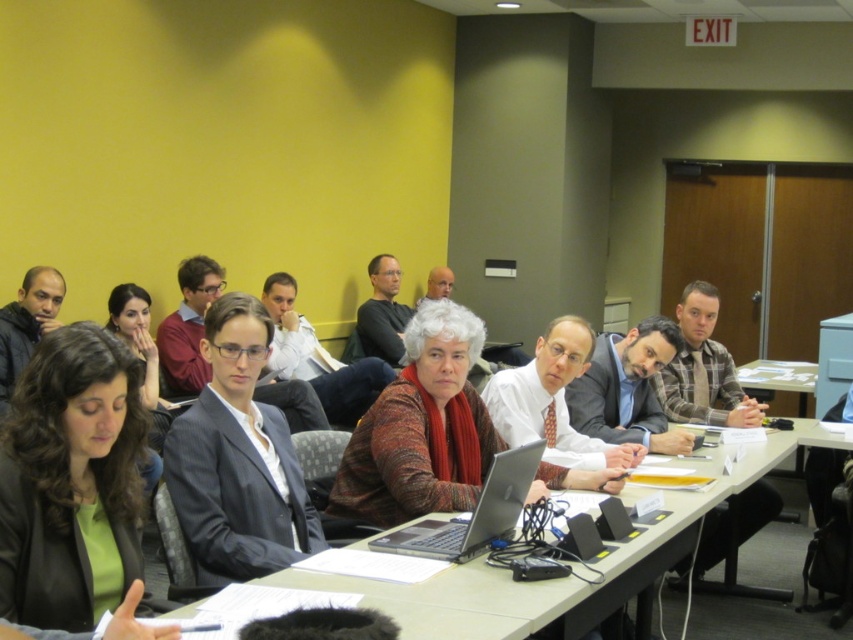
You are standing in the conference room described. You need to place a new laptop on the light brown wooden table at center. Given that the table is marked by the point at coordinates (x=544, y=580), can you confirm the location of the table?

The point at coordinates (x=544, y=580) marks the location of the light brown wooden table at center, so placing the laptop there would be correct.

You are organizing a photo shoot and need to ensure that the green matte blazer at lower left and the gray suit at center are visible in the frame. Given their sizes, which one might require more space to fully capture in the photo?

The gray suit at center requires more space because it is larger than the green matte blazer at lower left.

You are organizing a meeting and need to ensure there is enough space between the matte gray suit at center and the silver metallic laptop at center for attendees to comfortably move around. Based on their sizes, which object requires more horizontal space?

The matte gray suit at center requires more horizontal space because its width surpasses that of the silver metallic laptop at center.